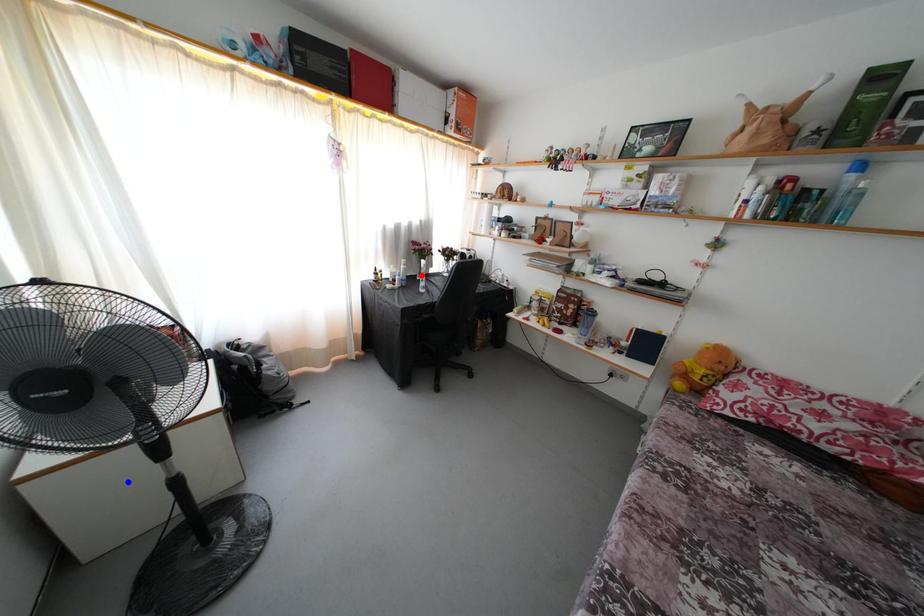
Question: In the image, two points are highlighted. Which point is nearer to the camera? Reply with the corresponding letter.

Choices:
 (A) blue point
 (B) red point

Answer: (A)